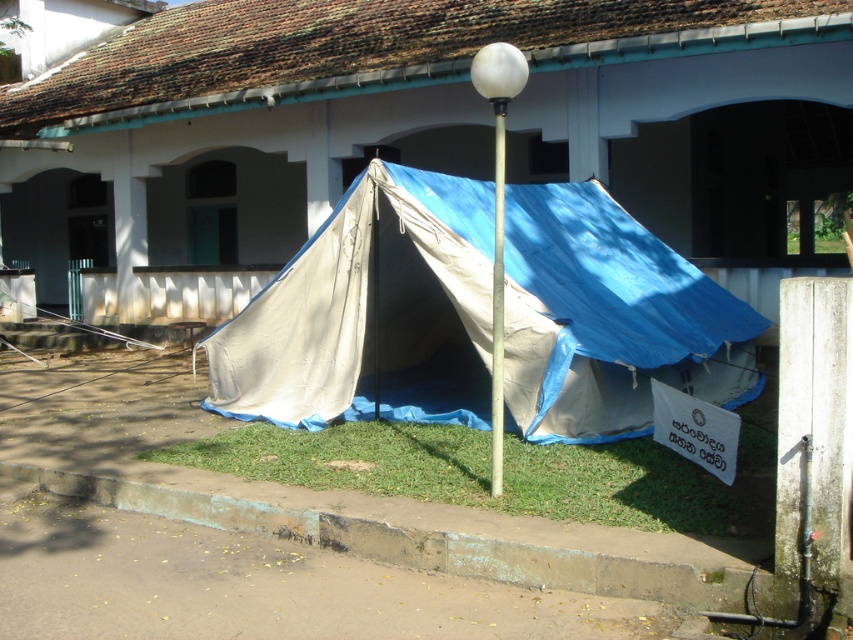
You are standing at the point with coordinates point (x=370, y=312). Based on the scene description, what structure are you currently located at?

The point (x=370, y=312) corresponds to the blue tarpaulin tent at center.

Consider the image. You are standing at the entrance of the building with arched windows and a balcony. You need to place a new sign exactly where the blue tarpaulin tent at center currently is. According to the coordinates provided, where should you place the new sign?

The blue tarpaulin tent at center is located at point (370, 312), so you should place the new sign at those coordinates to match its current position.

You are setting up a small flag on the white plastic pole at center. The flag requires the pole to be taller than the surrounding green grass at lower center to be visible. Based on the scene description, will the flag be visible?

The green grass at lower center is taller than the white plastic pole at center, so the flag will not be visible as it will be obscured by the grass.